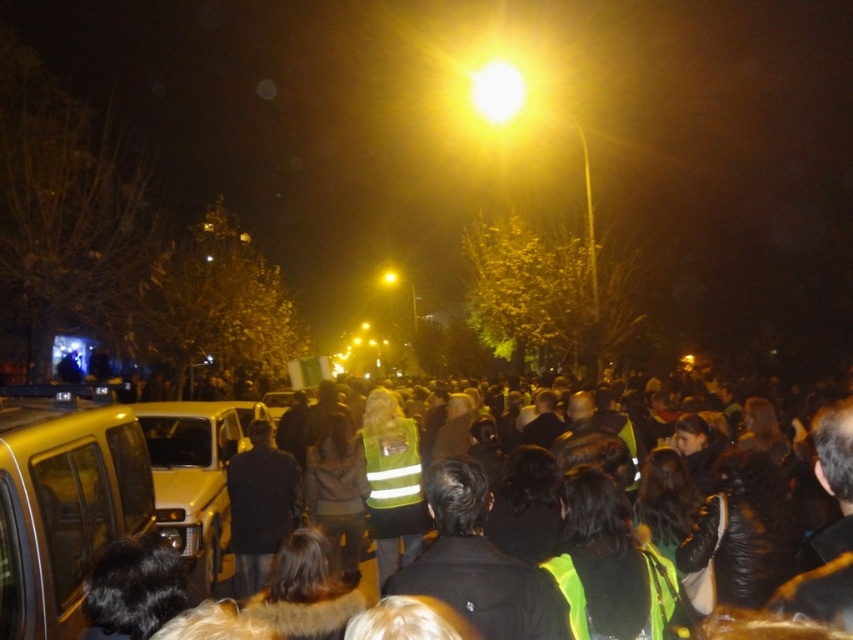
Does yellow reflective vest at center appear under metallic silver car at center?

Actually, yellow reflective vest at center is above metallic silver car at center.

The image size is (853, 640). Describe the element at coordinates (503, 147) in the screenshot. I see `yellow reflective vest at center` at that location.

This screenshot has height=640, width=853. What do you see at coordinates (503, 147) in the screenshot?
I see `yellow reflective vest at center` at bounding box center [503, 147].

I want to click on yellow reflective vest at center, so click(503, 147).

Does metallic gold taxi at lower left have a smaller size compared to yellow matte taxi at lower left?

Indeed, metallic gold taxi at lower left has a smaller size compared to yellow matte taxi at lower left.

How distant is metallic gold taxi at lower left from yellow matte taxi at lower left?

They are 2.47 meters apart.

Between point (59, 529) and point (178, 456), which one is positioned behind?

Positioned behind is point (178, 456).

Find the location of a particular element. The image size is (853, 640). metallic gold taxi at lower left is located at coordinates (62, 506).

Where is `reflective yellow vest at center`? The width and height of the screenshot is (853, 640). reflective yellow vest at center is located at coordinates (759, 512).

Does reflective yellow vest at center appear on the left side of dark fabric jacket at center?

In fact, reflective yellow vest at center is to the right of dark fabric jacket at center.

Who is more forward, (577,449) or (270,465)?

Point (577,449)

This screenshot has height=640, width=853. In order to click on reflective yellow vest at center in this screenshot , I will do `click(759, 512)`.